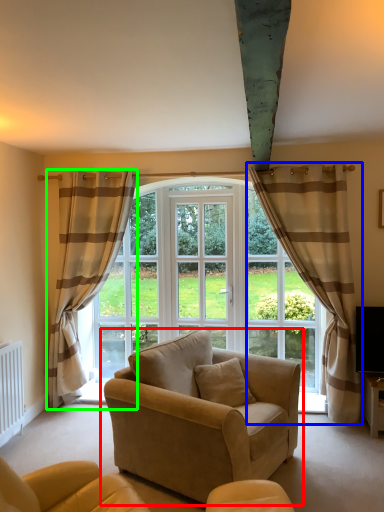
Question: Which object is positioned farthest from studio couch (highlighted by a red box)? Select from curtain (highlighted by a blue box) and curtain (highlighted by a green box).

Choices:
 (A) curtain
 (B) curtain

Answer: (B)